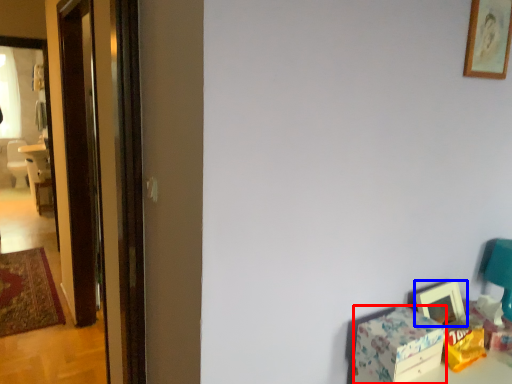
Question: Which of the following is the farthest to the observer, box (highlighted by a red box) or picture frame (highlighted by a blue box)?

Choices:
 (A) box
 (B) picture frame

Answer: (B)